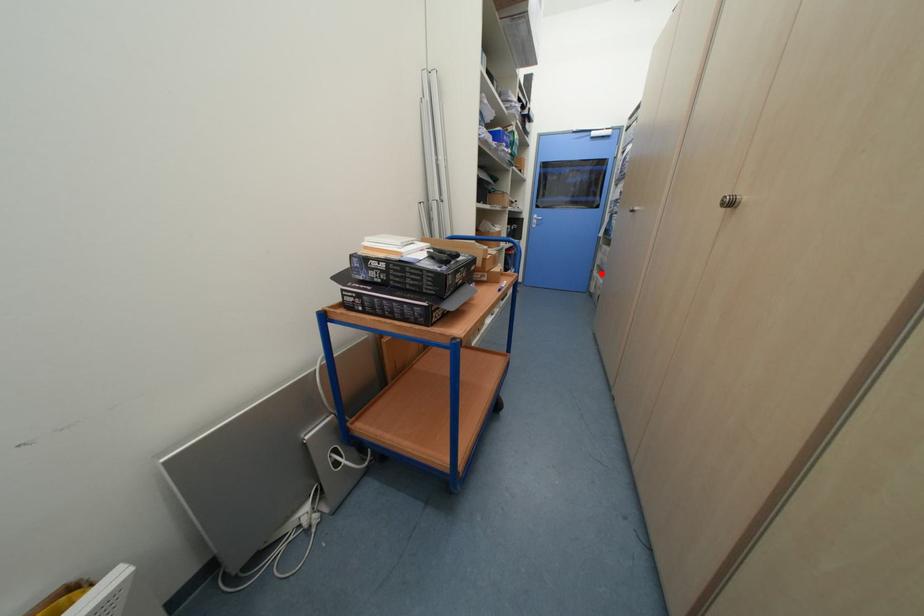
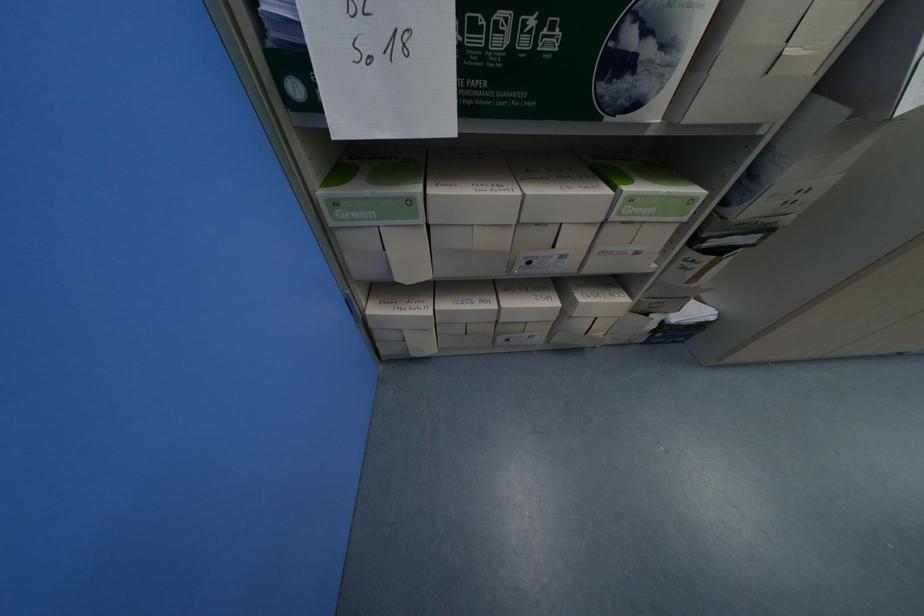
Find the pixel in the second image that matches the highlighted location in the first image.

(381, 312)